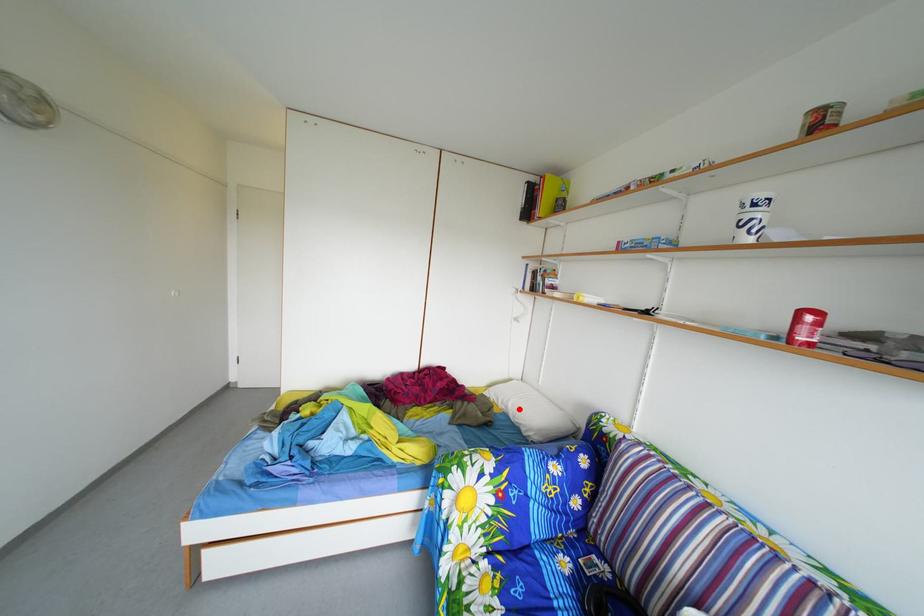
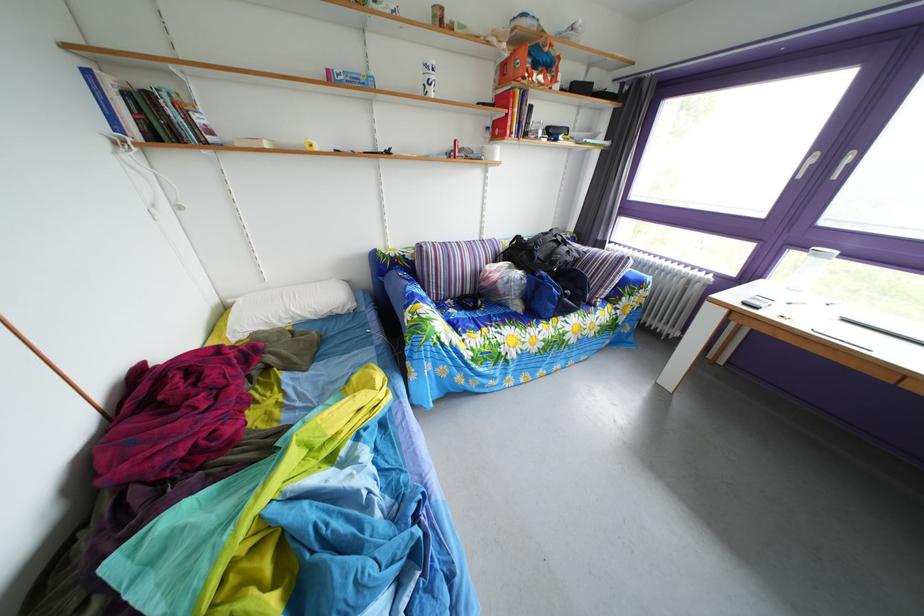
Question: A red point is marked in image1. In image2, is the corresponding 3D point closer to the camera or farther? Reply with the corresponding letter.

Choices:
 (A) The corresponding 3D point is closer.
 (B) The corresponding 3D point is farther.

Answer: (A)